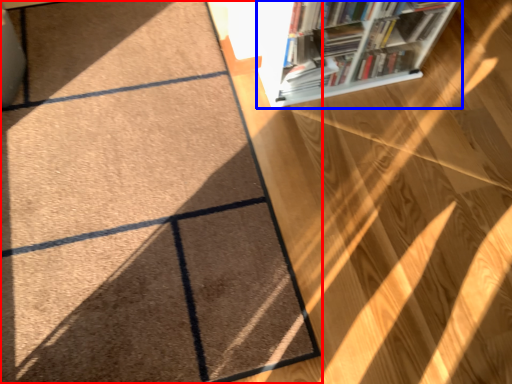
Question: Among these objects, which one is nearest to the camera, doormat (highlighted by a red box) or bookcase (highlighted by a blue box)?

Choices:
 (A) doormat
 (B) bookcase

Answer: (A)